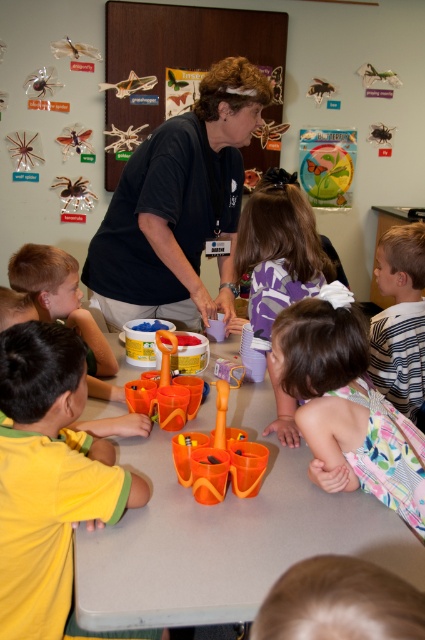
You are a photographer trying to capture a candid shot of the children during the activity. You notice the blonde hair at lower center and the striped fabric shirt at right. Which child should you focus on first to ensure both are in the frame without moving the camera?

You should focus on the blonde hair at lower center first because it is closer to the camera than the striped fabric shirt at right, ensuring both will be in the frame without needing to adjust the camera position.

You are a photographer standing in the classroom trying to capture a closeup shot of the point at coordinates (346,291). The camera you are using has a minimum focusing distance of 3 feet. Will you be able to take the photo without moving closer?

The point at coordinates (346,291) is 3.73 feet away from the camera. Since the minimum focusing distance is 3 feet, the camera can focus on objects at that distance, so yes, you can take the photo without moving closer.